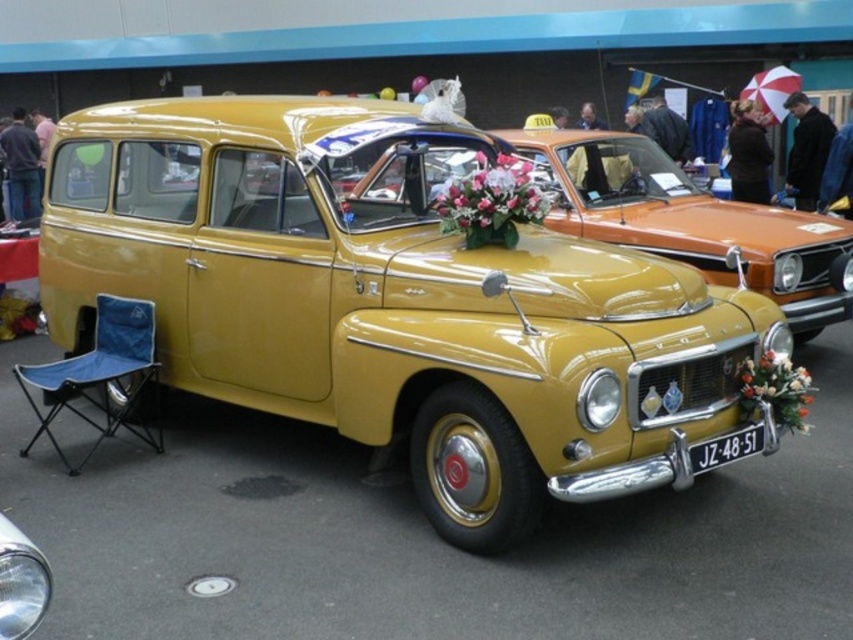
You are standing in front of a vintage Volvo car at a car show. The car has a floral arrangement on its front and a license plate reading JZ 48 51. You notice a point marked at coordinates (392, 301). Based on the scene, where is this point likely located on the car?

The point at coordinates (392, 301) is likely located on the shiny yellow car at center, as indicated by the description.

You are a photographer at the car show and want to take a photo that includes both the shiny yellow car at center and the black plastic license plate at lower center. Since you need to ensure both are clearly visible, which object should you focus on first to make sure it is in focus?

You should focus on the shiny yellow car at center first because it is bigger than the black plastic license plate at lower center, so ensuring it is in focus will naturally bring the smaller license plate into focus as well.